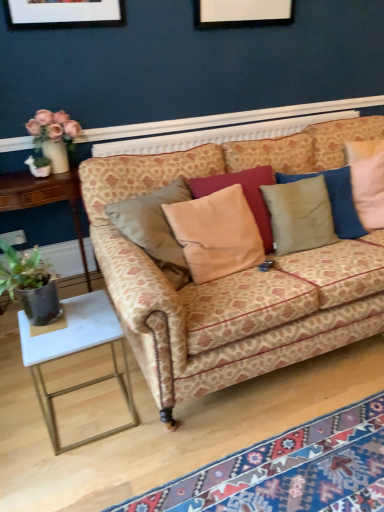
This screenshot has height=512, width=384. I want to click on blank area to the left of white marble side table at lower left, placed as the first table when sorted from bottom to top, so click(x=20, y=413).